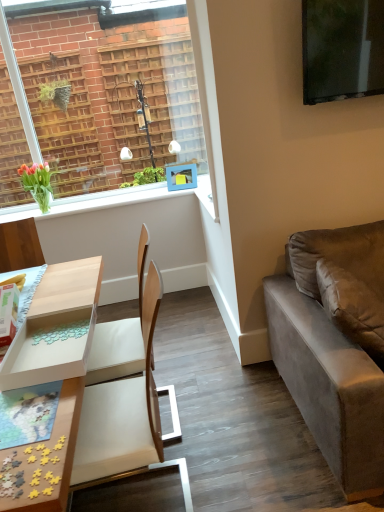
Question: In terms of height, does green glass vase at upper left look taller or shorter compared to light wood/wooden desk at lower left?

Choices:
 (A) tall
 (B) short

Answer: (B)

Question: Is point (69, 209) closer or farther from the camera than point (57, 474)?

Choices:
 (A) closer
 (B) farther

Answer: (B)

Question: Which object is the farthest from the clear glass window at upper left?

Choices:
 (A) green glass vase at upper left
 (B) green matte vase at upper left
 (C) light blue plastic picture frame at upper center
 (D) suede gray couch at right
 (E) light wood/wooden desk at lower left

Answer: (D)

Question: Based on their relative distances, which object is farther from the light wood/wooden desk at lower left?

Choices:
 (A) suede gray couch at right
 (B) clear glass window at upper left
 (C) green matte vase at upper left
 (D) light blue plastic picture frame at upper center
 (E) green glass vase at upper left

Answer: (D)